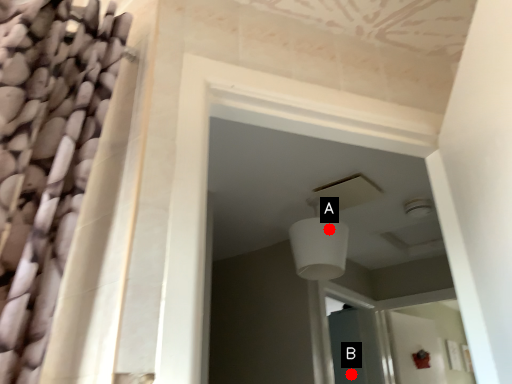
Question: Two points are circled on the image, labeled by A and B beside each circle. Which of the following is the farthest from the observer?

Choices:
 (A) A is further
 (B) B is further

Answer: (B)